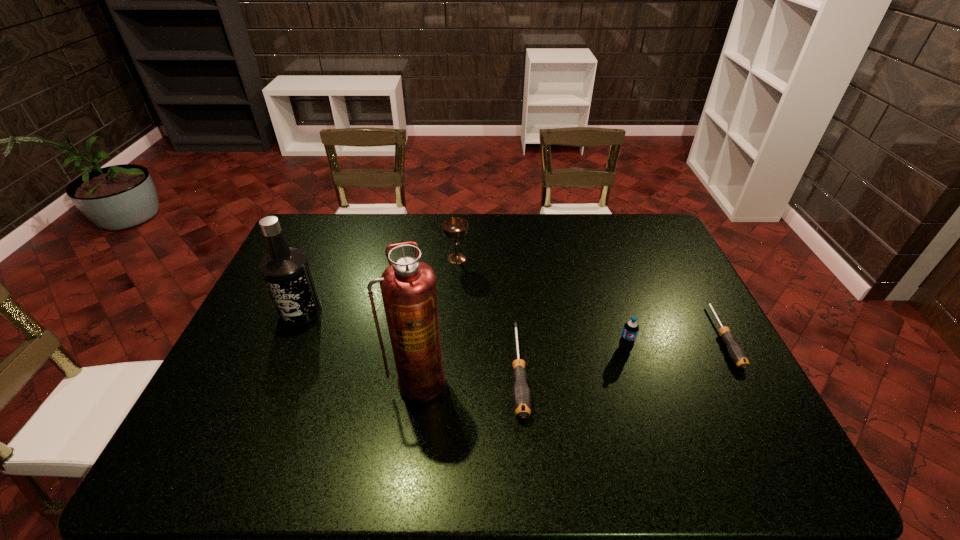
In the current image, all screwdrivers are evenly spaced. To maintain this equal spacing, where should an additional screwdriver be placed on the left? Please point out a free spot. Please provide its 2D coordinates. Your answer should be formatted as a tuple, i.e. [(x, y)], where the tuple contains the x and y coordinates of a point satisfying the conditions above.

[(280, 412)]